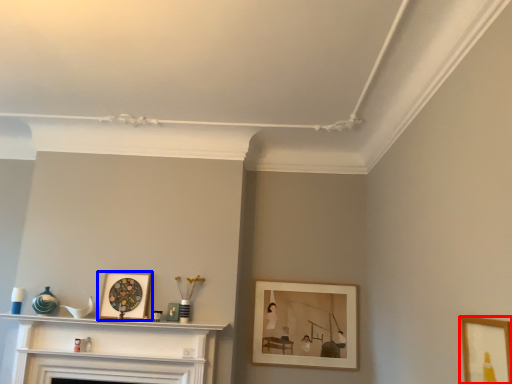
Question: Which object appears closest to the camera in this image, picture frame (highlighted by a red box) or picture frame (highlighted by a blue box)?

Choices:
 (A) picture frame
 (B) picture frame

Answer: (A)